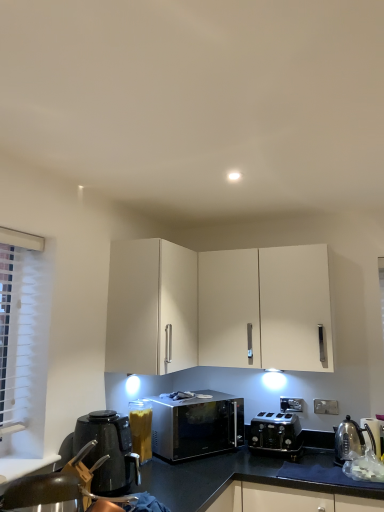
Question: Can you confirm if sleek metallic microwave at center is positioned to the right of metallic silver kettle at right, which appears as the 3th appliance when viewed from the left?

Choices:
 (A) yes
 (B) no

Answer: (B)

Question: From a real-world perspective, does sleek metallic microwave at center stand above metallic silver kettle at right, which is the 1th appliance from right to left?

Choices:
 (A) no
 (B) yes

Answer: (B)

Question: Can metallic silver kettle at right, which appears as the 3th appliance when viewed from the left, be found inside sleek metallic microwave at center?

Choices:
 (A) no
 (B) yes

Answer: (A)

Question: Is sleek metallic microwave at center beside metallic silver kettle at right, which appears as the 3th appliance when viewed from the left?

Choices:
 (A) yes
 (B) no

Answer: (B)

Question: From the image's perspective, is sleek metallic microwave at center under metallic silver kettle at right, which appears as the 3th appliance when viewed from the left?

Choices:
 (A) no
 (B) yes

Answer: (A)

Question: Does point (322, 408) appear closer or farther from the camera than point (365, 440)?

Choices:
 (A) farther
 (B) closer

Answer: (A)

Question: From the image's perspective, is white plastic electric outlet at lower right above or below metallic silver kettle at right, which appears as the 3th appliance when viewed from the left?

Choices:
 (A) above
 (B) below

Answer: (A)

Question: Is white plastic electric outlet at lower right taller or shorter than metallic silver kettle at right, which appears as the 3th appliance when viewed from the left?

Choices:
 (A) short
 (B) tall

Answer: (A)

Question: Considering the positions of white plastic electric outlet at lower right and metallic silver kettle at right, which appears as the 3th appliance when viewed from the left, in the image, is white plastic electric outlet at lower right wider or thinner than metallic silver kettle at right, which appears as the 3th appliance when viewed from the left,?

Choices:
 (A) thin
 (B) wide

Answer: (A)

Question: In the image, is white matte cabinet at upper center positioned in front of or behind black metallic toaster at lower center?

Choices:
 (A) front
 (B) behind

Answer: (A)

Question: Visually, is white matte cabinet at upper center positioned to the left or to the right of black metallic toaster at lower center?

Choices:
 (A) left
 (B) right

Answer: (A)

Question: Choose the correct answer: Is white matte cabinet at upper center inside black metallic toaster at lower center or outside it?

Choices:
 (A) outside
 (B) inside

Answer: (A)

Question: Considering the positions of white matte cabinet at upper center and black metallic toaster at lower center in the image, is white matte cabinet at upper center taller or shorter than black metallic toaster at lower center?

Choices:
 (A) tall
 (B) short

Answer: (A)

Question: Does point (109, 498) appear closer or farther from the camera than point (130, 451)?

Choices:
 (A) closer
 (B) farther

Answer: (A)

Question: In terms of width, does metallic silver swivel chair at lower left look wider or thinner when compared to black plastic kettle at lower left?

Choices:
 (A) wide
 (B) thin

Answer: (A)